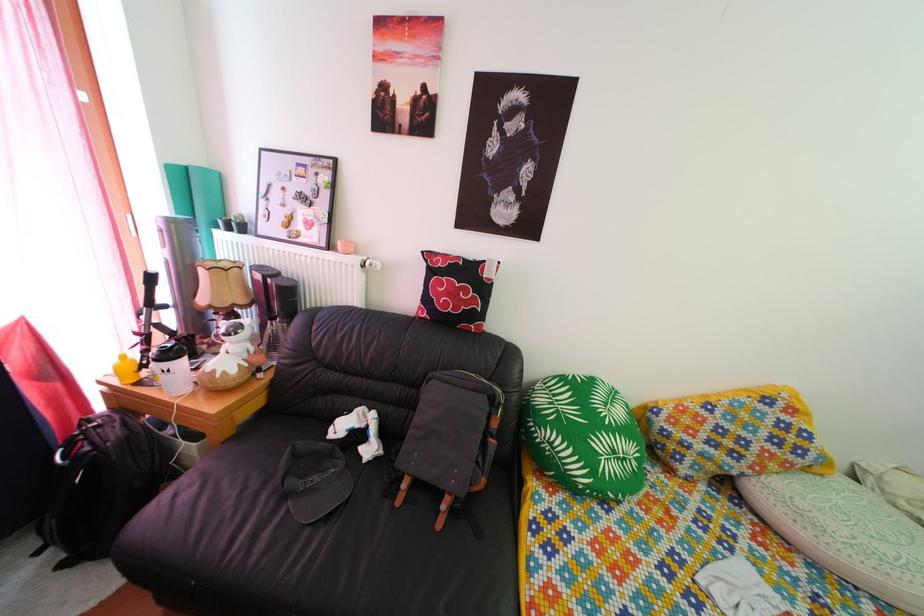
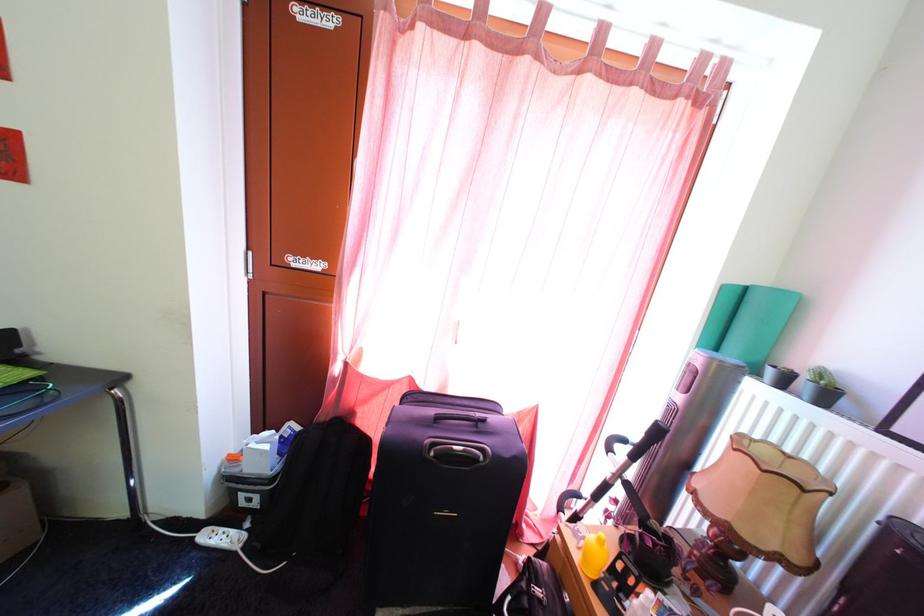
Find the pixel in the second image that matches (x=196, y=177) in the first image.

(756, 297)